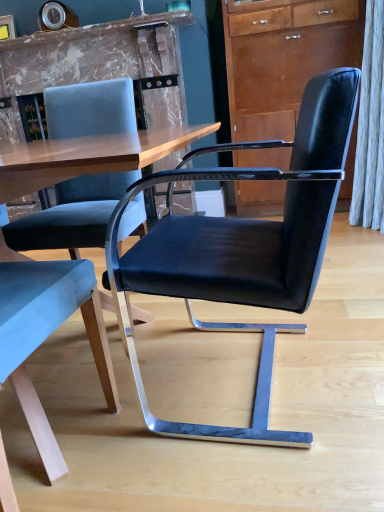
At what (x,y) coordinates should I click in order to perform the action: click on free area below black leather chair at center, placed as the second chair when sorted from left to right (from a real-world perspective). Please return your answer as a coordinate pair (x, y). The height and width of the screenshot is (512, 384). Looking at the image, I should click on (236, 372).